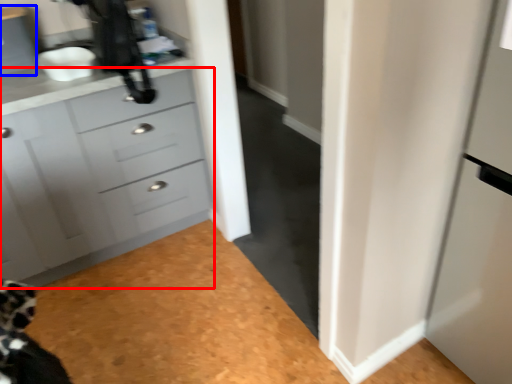
Question: Which point is further to the camera, chest of drawers (highlighted by a red box) or cabinetry (highlighted by a blue box)?

Choices:
 (A) chest of drawers
 (B) cabinetry

Answer: (B)